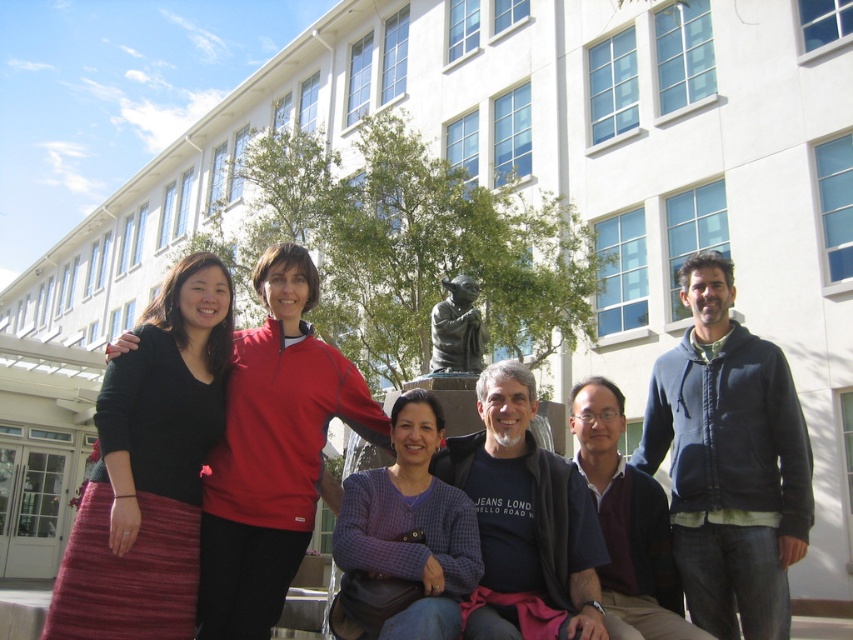
Between purple checkered sweater at center and bronze statue at center, which one is positioned lower?

purple checkered sweater at center is lower down.

Can you confirm if purple checkered sweater at center is wider than bronze statue at center?

Indeed, purple checkered sweater at center has a greater width compared to bronze statue at center.

Does point (341, 560) come farther from viewer compared to point (474, 337)?

No, (341, 560) is in front of (474, 337).

The width and height of the screenshot is (853, 640). Find the location of `purple checkered sweater at center`. purple checkered sweater at center is located at coordinates (405, 536).

Can you confirm if black knit skirt at left is positioned below bronze statue at center?

Correct, black knit skirt at left is located below bronze statue at center.

Is black knit skirt at left to the left of bronze statue at center from the viewer's perspective?

Correct, you'll find black knit skirt at left to the left of bronze statue at center.

Locate an element on the screen. black knit skirt at left is located at coordinates (149, 468).

Can you confirm if matte red jacket at center is shorter than purple checkered sweater at center?

Indeed, matte red jacket at center has a lesser height compared to purple checkered sweater at center.

Who is shorter, matte red jacket at center or purple checkered sweater at center?

matte red jacket at center is shorter.

Measure the distance between matte red jacket at center and camera.

matte red jacket at center is 16.77 meters from camera.

This screenshot has width=853, height=640. What are the coordinates of `matte red jacket at center` in the screenshot? It's located at (271, 451).